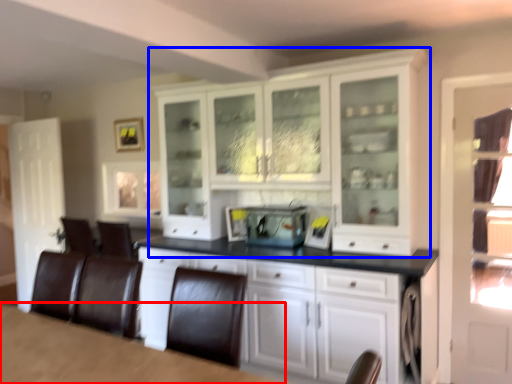
Question: Which object appears closest to the camera in this image, table (highlighted by a red box) or cabinetry (highlighted by a blue box)?

Choices:
 (A) table
 (B) cabinetry

Answer: (A)